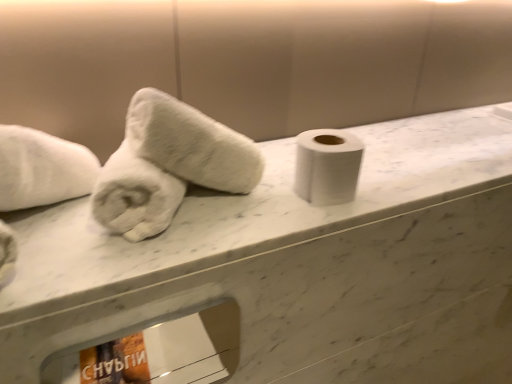
Question: Is white fluffy towel at left, which is counted as the 2th towel, starting from the right, completely or partially outside of white fluffy towel at left, the 1th towel in the right-to-left sequence?

Choices:
 (A) no
 (B) yes

Answer: (A)

Question: Is white fluffy towel at left, positioned as the first towel in left-to-right order, at the right side of white fluffy towel at left, the 1th towel in the right-to-left sequence?

Choices:
 (A) no
 (B) yes

Answer: (A)

Question: Considering the relative sizes of white fluffy towel at left, which is counted as the 2th towel, starting from the right, and white fluffy towel at left, the 1th towel in the right-to-left sequence, in the image provided, is white fluffy towel at left, which is counted as the 2th towel, starting from the right, thinner than white fluffy towel at left, the 1th towel in the right-to-left sequence,?

Choices:
 (A) no
 (B) yes

Answer: (A)

Question: Does white fluffy towel at left, positioned as the first towel in left-to-right order, have a greater height compared to white fluffy towel at left, the 1th towel in the right-to-left sequence?

Choices:
 (A) yes
 (B) no

Answer: (B)

Question: Is the position of white fluffy towel at left, positioned as the first towel in left-to-right order, more distant than that of white fluffy towel at left, positioned as the 2th towel in left-to-right order?

Choices:
 (A) yes
 (B) no

Answer: (B)

Question: Considering the relative positions of white fluffy towel at left, which is counted as the 2th towel, starting from the right, and white fluffy towel at left, positioned as the 2th towel in left-to-right order, in the image provided, is white fluffy towel at left, which is counted as the 2th towel, starting from the right, to the left of white fluffy towel at left, positioned as the 2th towel in left-to-right order, from the viewer's perspective?

Choices:
 (A) yes
 (B) no

Answer: (A)

Question: Is white fluffy towel at left, positioned as the 2th towel in left-to-right order, smaller than white fluffy towel at left, positioned as the first towel in left-to-right order?

Choices:
 (A) no
 (B) yes

Answer: (A)

Question: From a real-world perspective, is white fluffy towel at left, the 1th towel in the right-to-left sequence, on top of white fluffy towel at left, which is counted as the 2th towel, starting from the right?

Choices:
 (A) yes
 (B) no

Answer: (A)

Question: Is white fluffy towel at left, which is counted as the 2th towel, starting from the right, a part of white fluffy towel at left, positioned as the 2th towel in left-to-right order?

Choices:
 (A) no
 (B) yes

Answer: (B)

Question: Does white fluffy towel at left, the 1th towel in the right-to-left sequence, have a greater width compared to white fluffy towel at left, positioned as the first towel in left-to-right order?

Choices:
 (A) no
 (B) yes

Answer: (A)

Question: Is white fluffy towel at left, positioned as the 2th towel in left-to-right order, to the left of white fluffy towel at left, positioned as the first towel in left-to-right order, from the viewer's perspective?

Choices:
 (A) no
 (B) yes

Answer: (A)

Question: Is white fluffy towel at left, positioned as the 2th towel in left-to-right order, at the right side of white fluffy towel at left, positioned as the first towel in left-to-right order?

Choices:
 (A) no
 (B) yes

Answer: (B)

Question: Does white fluffy towel at left, positioned as the 2th towel in left-to-right order, have a lesser width compared to white matte toilet paper at center?

Choices:
 (A) yes
 (B) no

Answer: (B)